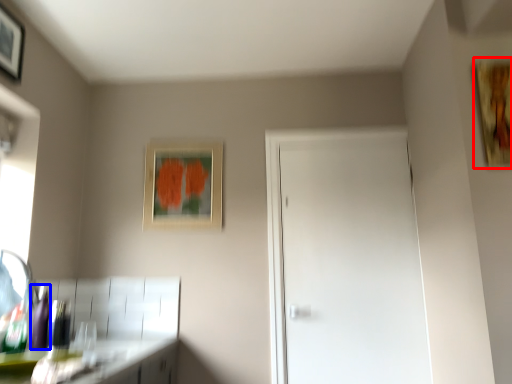
Question: Which object appears closest to the camera in this image, picture frame (highlighted by a red box) or bottle (highlighted by a blue box)?

Choices:
 (A) picture frame
 (B) bottle

Answer: (A)